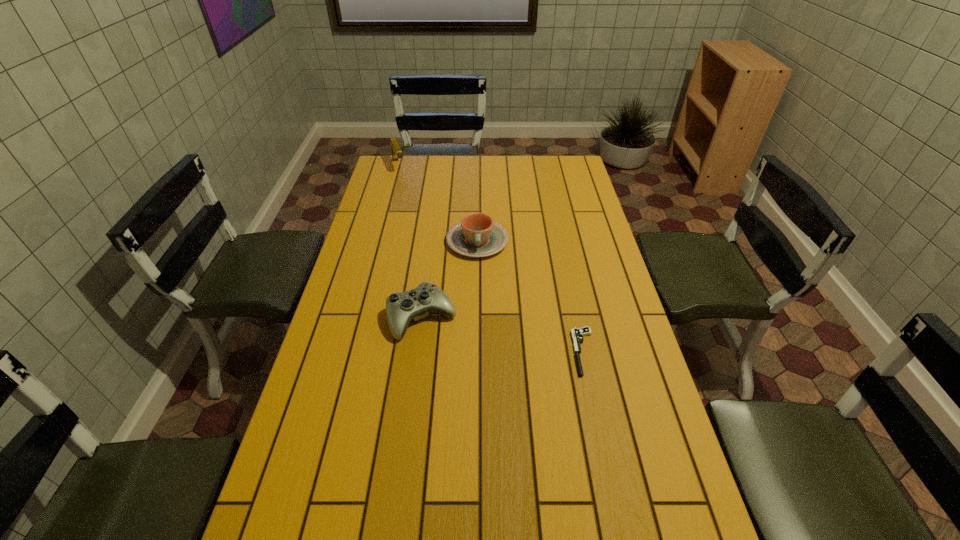
Where is `empty space that is in between the control and the right pistol`? The width and height of the screenshot is (960, 540). empty space that is in between the control and the right pistol is located at coordinates (503, 335).

The width and height of the screenshot is (960, 540). I want to click on vacant point located between the farther pistol and the control, so click(410, 241).

At what (x,y) coordinates should I click in order to perform the action: click on free space between the control and the shorter pistol. Please return your answer as a coordinate pair (x, y). The width and height of the screenshot is (960, 540). Looking at the image, I should click on (503, 335).

The height and width of the screenshot is (540, 960). Find the location of `vacant space in between the leftmost object and the control`. vacant space in between the leftmost object and the control is located at coordinates (410, 241).

I want to click on object that is the second nearest to the control, so click(x=577, y=334).

The image size is (960, 540). I want to click on object identified as the second closest to the second farthest object, so click(577, 334).

At what (x,y) coordinates should I click in order to perform the action: click on vacant space that satisfies the following two spatial constraints: 1. on the back side of the chinaware; 2. on the right side of the control. Please return your answer as a coordinate pair (x, y). The width and height of the screenshot is (960, 540). Looking at the image, I should click on (432, 241).